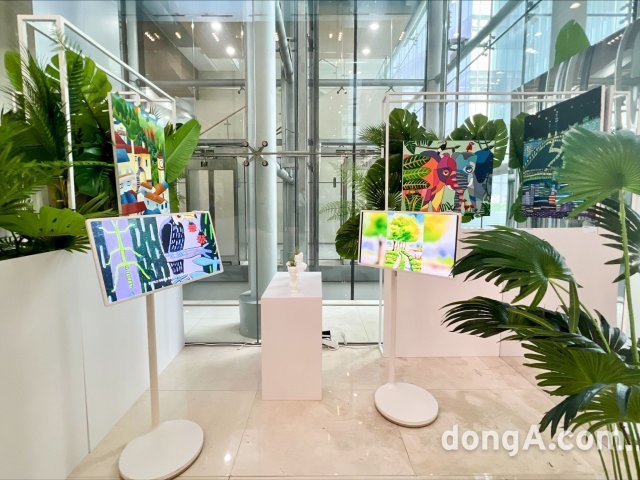
The image size is (640, 480). I want to click on white table, so click(294, 343).